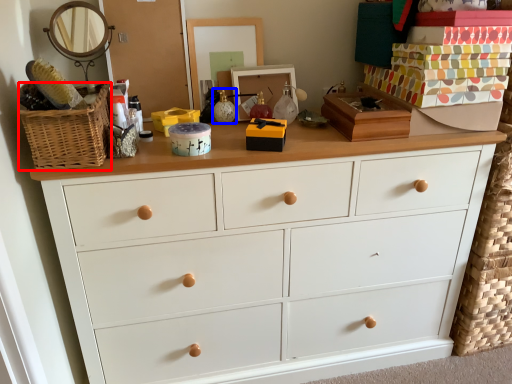
Question: Which of the following is the farthest to the observer, basket (highlighted by a red box) or toy (highlighted by a blue box)?

Choices:
 (A) basket
 (B) toy

Answer: (B)